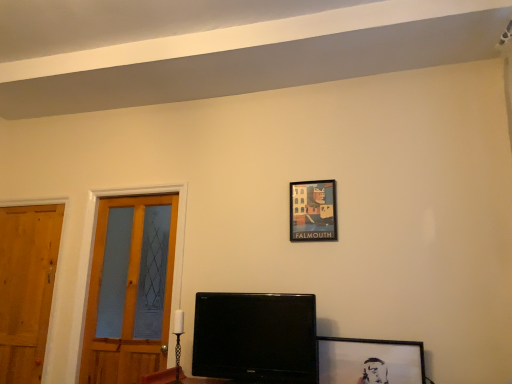
Question: In the image, is wooden door at left, placed as the 2th door when sorted from left to right, positioned in front of or behind wooden door at left, positioned as the first door in left-to-right order?

Choices:
 (A) behind
 (B) front

Answer: (B)

Question: Based on their sizes in the image, would you say wooden door at left, placed as the 2th door when sorted from left to right, is bigger or smaller than wooden door at left, the second door viewed from the right?

Choices:
 (A) small
 (B) big

Answer: (B)

Question: Estimate the real-world distances between objects in this image. Which object is closer to the wooden door at left, placed as the 2th door when sorted from left to right?

Choices:
 (A) matte paper picture frame at upper center, the second picture frame ordered from the bottom
 (B) black matte picture frame at lower right, which appears as the second picture frame when viewed from the top
 (C) black glossy monitor at center
 (D) wooden door at left, positioned as the first door in left-to-right order

Answer: (D)

Question: Estimate the real-world distances between objects in this image. Which object is closer to the black glossy monitor at center?

Choices:
 (A) wooden door at left, positioned as the first door in left-to-right order
 (B) wooden door at left, placed as the 2th door when sorted from left to right
 (C) matte paper picture frame at upper center, the first picture frame from the back
 (D) black matte picture frame at lower right, the 2th picture frame positioned from the back

Answer: (D)